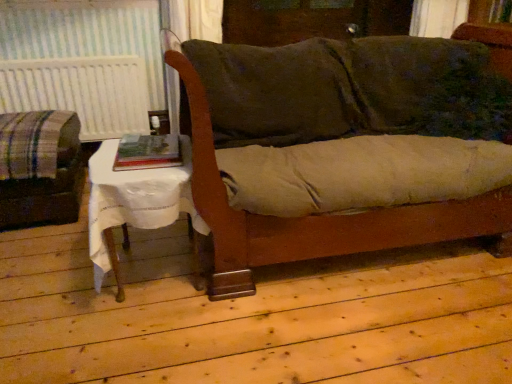
Locate an element on the screen. The height and width of the screenshot is (384, 512). vacant space underneath white cloth-covered table at lower left (from a real-world perspective) is located at coordinates (137, 282).